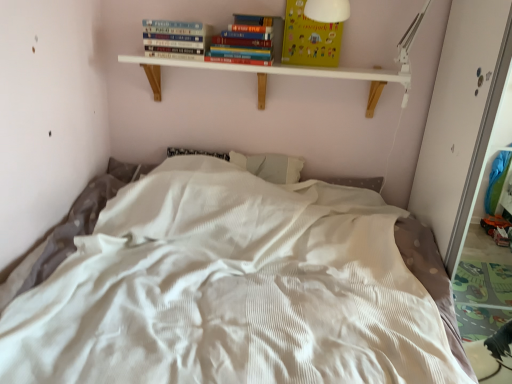
The width and height of the screenshot is (512, 384). What do you see at coordinates (174, 39) in the screenshot?
I see `hardcover book at upper center` at bounding box center [174, 39].

What is the approximate width of yellow paper at upper center?

The width of yellow paper at upper center is 2.60 inches.

I want to click on hardcover book at upper center, so click(x=174, y=39).

Considering the positions of objects hardcover book at upper center and white wood shelf at upper center in the image provided, who is more to the right, hardcover book at upper center or white wood shelf at upper center?

From the viewer's perspective, white wood shelf at upper center appears more on the right side.

Is hardcover book at upper center oriented away from white wood shelf at upper center?

That's not correct — hardcover book at upper center is not looking away from white wood shelf at upper center.

The height and width of the screenshot is (384, 512). I want to click on shelf below the hardcover book at upper center (from the image's perspective), so click(288, 72).

Is hardcover book at upper center bigger or smaller than white wood shelf at upper center?

hardcover book at upper center is smaller than white wood shelf at upper center.

Consider the image. Is there a large distance between white wood shelf at upper center and hardcover book at upper center?

No, white wood shelf at upper center is not far away from hardcover book at upper center.

Which is nearer, (241, 68) or (194, 45)?

Positioned in front is point (194, 45).

Which of these two, white wood shelf at upper center or hardcover book at upper center, is thinner?

hardcover book at upper center.

Between white wood shelf at upper center and hardcover book at upper center, which one appears on the left side from the viewer's perspective?

From the viewer's perspective, hardcover book at upper center appears more on the left side.

From the image's perspective, does hardcover book at upper center appear higher than yellow paper at upper center?

Actually, hardcover book at upper center appears below yellow paper at upper center in the image.

Is hardcover book at upper center smaller than yellow paper at upper center?

Incorrect, hardcover book at upper center is not smaller in size than yellow paper at upper center.

Is yellow paper at upper center at the back of hardcover book at upper center?

No, hardcover book at upper center is not facing the opposite direction of yellow paper at upper center.

Consider the image. Considering the relative sizes of hardcover book at upper center and yellow paper at upper center in the image provided, is hardcover book at upper center taller than yellow paper at upper center?

No.

Where is `bed below the hardcover book at upper center (from a real-world perspective)`? The width and height of the screenshot is (512, 384). bed below the hardcover book at upper center (from a real-world perspective) is located at coordinates (230, 289).

In the scene shown: Does white textured bed at center have a smaller size compared to hardcover book at upper center?

Incorrect, white textured bed at center is not smaller in size than hardcover book at upper center.

Is white textured bed at center thinner than hardcover book at upper center?

No, white textured bed at center is not thinner than hardcover book at upper center.

Is white textured bed at center positioned far away from white wood shelf at upper center?

They are positioned close to each other.

Which of these two, white textured bed at center or white wood shelf at upper center, is bigger?

white textured bed at center.

From the image's perspective, is white textured bed at center above white wood shelf at upper center?

No, from the image's perspective, white textured bed at center is not on top of white wood shelf at upper center.

Is white textured bed at center looking in the opposite direction of white wood shelf at upper center?

white textured bed at center is not turned away from white wood shelf at upper center.

Would you say yellow paper at upper center is outside white textured bed at center?

Yes, yellow paper at upper center is not within white textured bed at center.

From the image's perspective, which is below, yellow paper at upper center or white textured bed at center?

white textured bed at center, from the image's perspective.

Which point is more distant from viewer, (307, 36) or (343, 358)?

The point (307, 36) is farther.

Is yellow paper at upper center further to camera compared to white textured bed at center?

Yes.

In the scene shown: Is hardcover book at upper center not close to white textured bed at center?

hardcover book at upper center is near white textured bed at center, not far away.

Where is `book behind the white textured bed at center`? This screenshot has width=512, height=384. book behind the white textured bed at center is located at coordinates (174, 39).

Is hardcover book at upper center aimed at white textured bed at center?

No, hardcover book at upper center is not oriented towards white textured bed at center.

Locate an element on the screen. This screenshot has height=384, width=512. book on the left of the white wood shelf at upper center is located at coordinates (174, 39).

Where is `shelf below the hardcover book at upper center (from a real-world perspective)`? This screenshot has width=512, height=384. shelf below the hardcover book at upper center (from a real-world perspective) is located at coordinates (288, 72).

When comparing their distances from yellow paper at upper center, does white textured bed at center or white wood shelf at upper center seem closer?

The object closer to yellow paper at upper center is white wood shelf at upper center.

From the image, which object appears to be farther from yellow paper at upper center, hardcover book at upper center or white textured bed at center?

The object further to yellow paper at upper center is white textured bed at center.

Considering their positions, is hardcover book at upper center positioned closer to white textured bed at center than white wood shelf at upper center?

white wood shelf at upper center.

Based on their spatial positions, is white wood shelf at upper center or white textured bed at center closer to hardcover book at upper center?

Among the two, white wood shelf at upper center is located nearer to hardcover book at upper center.

When comparing their distances from white textured bed at center, does white wood shelf at upper center or hardcover book at upper center seem further?

The object further to white textured bed at center is hardcover book at upper center.

Based on their spatial positions, is hardcover book at upper center or white wood shelf at upper center closer to yellow paper at upper center?

Based on the image, white wood shelf at upper center appears to be nearer to yellow paper at upper center.

Which object lies further to the anchor point white textured bed at center, yellow paper at upper center or white wood shelf at upper center?

yellow paper at upper center.

From the picture: Estimate the real-world distances between objects in this image. Which object is closer to yellow paper at upper center, white wood shelf at upper center or hardcover book at upper center?

white wood shelf at upper center.

The height and width of the screenshot is (384, 512). Find the location of `shelf between yellow paper at upper center and white textured bed at center from top to bottom`. shelf between yellow paper at upper center and white textured bed at center from top to bottom is located at coordinates (288, 72).

Locate an element on the screen. This screenshot has height=384, width=512. book that lies between yellow paper at upper center and white textured bed at center from top to bottom is located at coordinates (174, 39).

Find the location of `shelf between hardcover book at upper center and white textured bed at center from top to bottom`. shelf between hardcover book at upper center and white textured bed at center from top to bottom is located at coordinates (288, 72).

This screenshot has height=384, width=512. In order to click on shelf between hardcover book at upper center and yellow paper at upper center from left to right in this screenshot , I will do [288, 72].